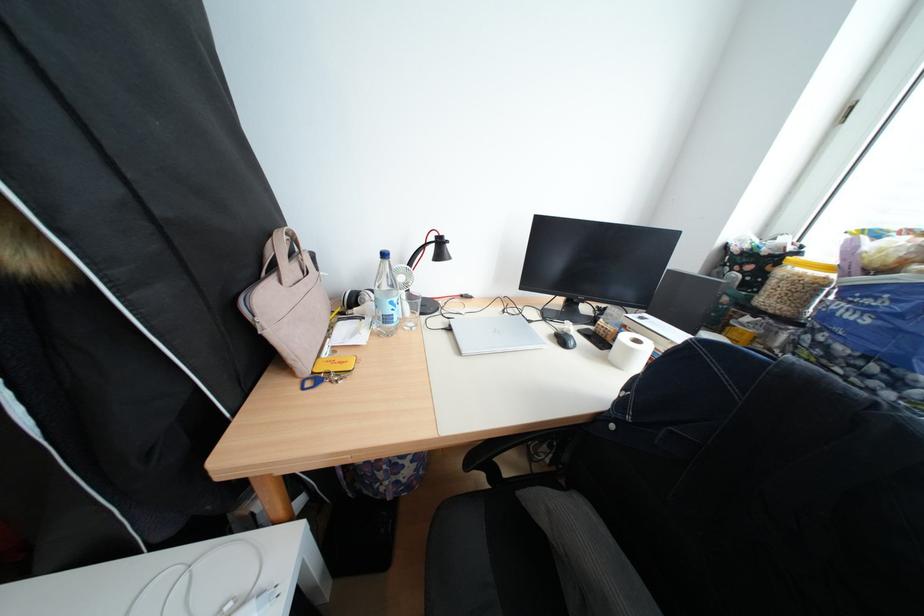
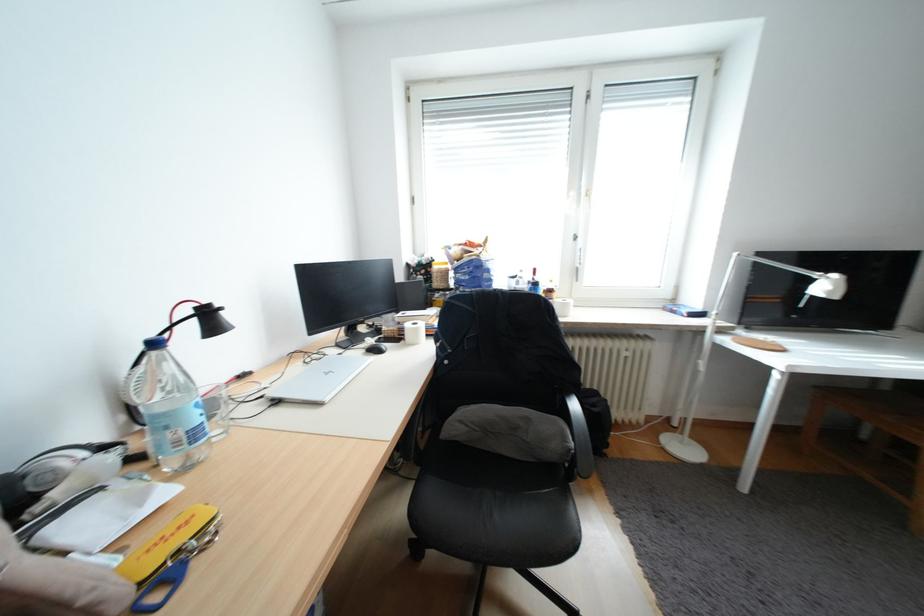
Question: The first image is from the beginning of the video and the second image is from the end. How did the camera likely rotate when shooting the video?

Choices:
 (A) Left
 (B) Right
 (C) Up
 (D) Down

Answer: (B)